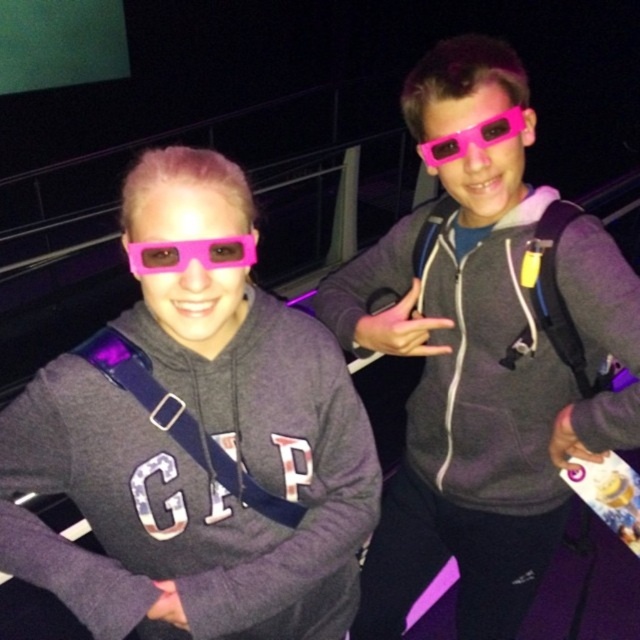
Does matte gray hoodie at center have a greater height compared to pink plastic glasses at upper center?

Correct, matte gray hoodie at center is much taller as pink plastic glasses at upper center.

Which of these two, matte gray hoodie at center or pink plastic glasses at upper center, stands taller?

matte gray hoodie at center

What do you see at coordinates (468, 369) in the screenshot? I see `matte gray hoodie at center` at bounding box center [468, 369].

Locate an element on the screen. This screenshot has width=640, height=640. matte gray hoodie at center is located at coordinates (468, 369).

The width and height of the screenshot is (640, 640). What do you see at coordinates (196, 472) in the screenshot?
I see `matte pink glasses at center` at bounding box center [196, 472].

Identify the location of matte pink glasses at center. The image size is (640, 640). (196, 472).

Can you confirm if matte pink glasses at center is positioned below pink matte glasses at center?

Yes.

Looking at this image, between matte pink glasses at center and pink matte glasses at center, which one is positioned higher?

pink matte glasses at center is higher up.

Is point (20, 572) positioned after point (252, 244)?

Yes, it is.

The height and width of the screenshot is (640, 640). I want to click on matte pink glasses at center, so click(x=196, y=472).